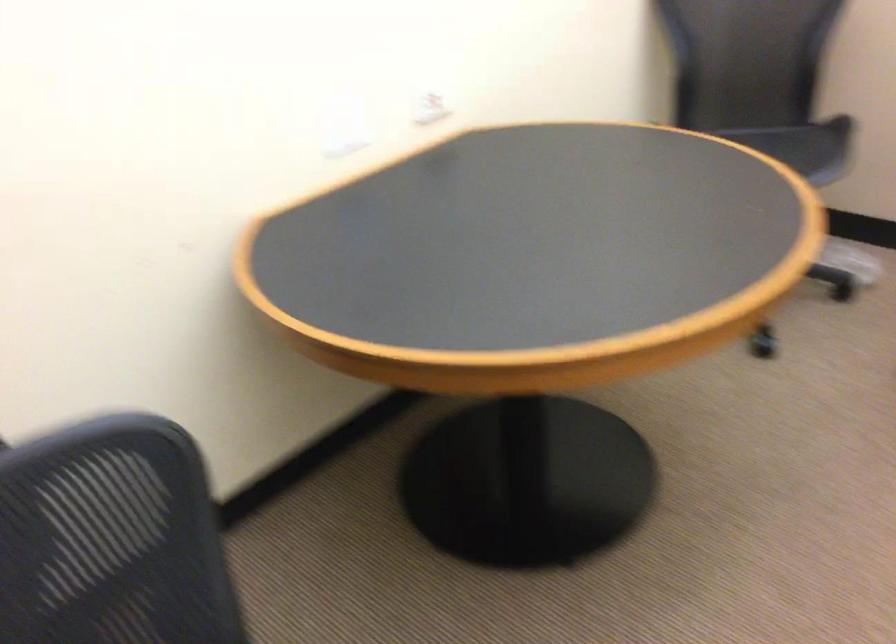
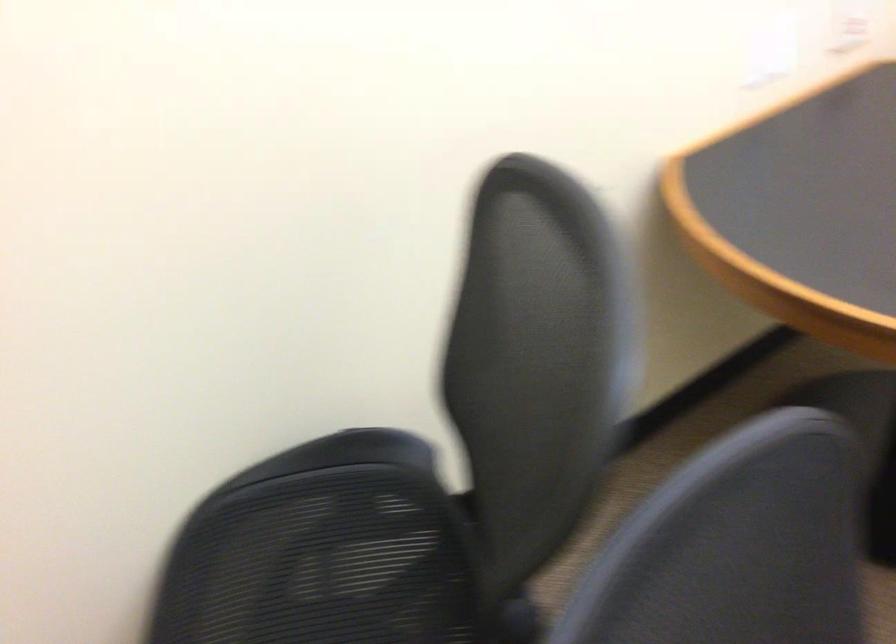
Question: The camera is either moving clockwise (left) or counter-clockwise (right) around the object. The first image is from the beginning of the video and the second image is from the end. Is the camera moving left or right when shooting the video?

Choices:
 (A) Left
 (B) Right

Answer: (B)